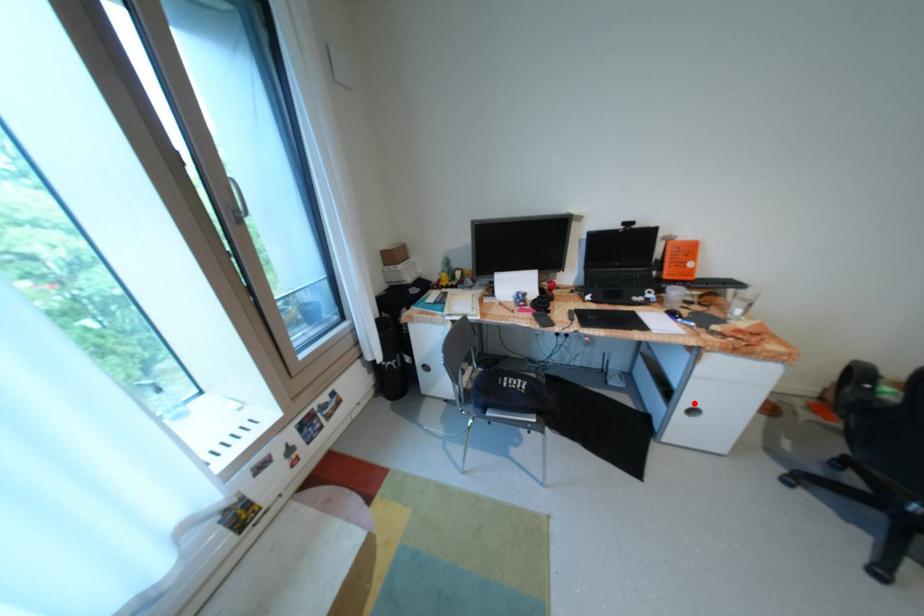
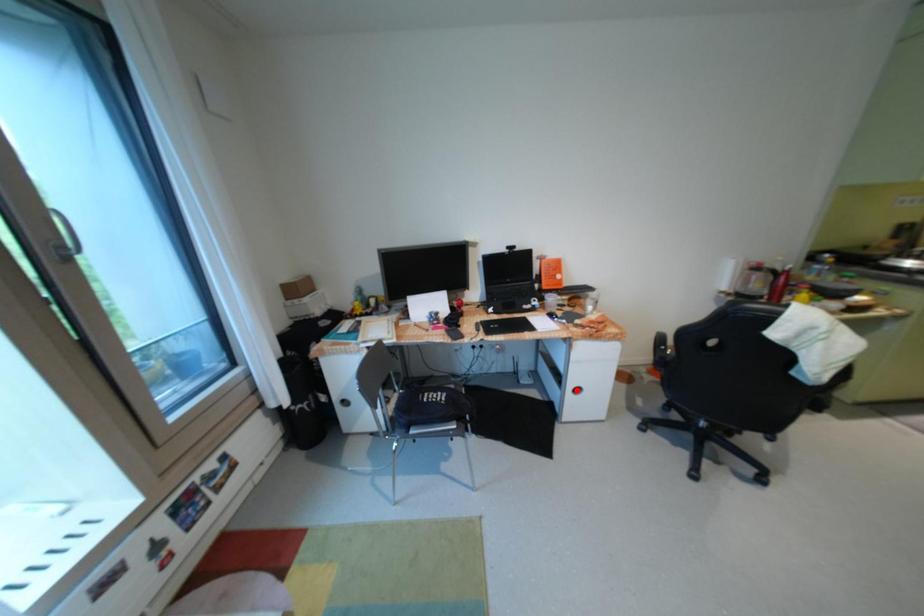
I am providing you with two images of the same scene from different viewpoints. A red point is marked on the first image and another point is marked on the second image. Is the red point in image1 aligned with the point shown in image2?

No